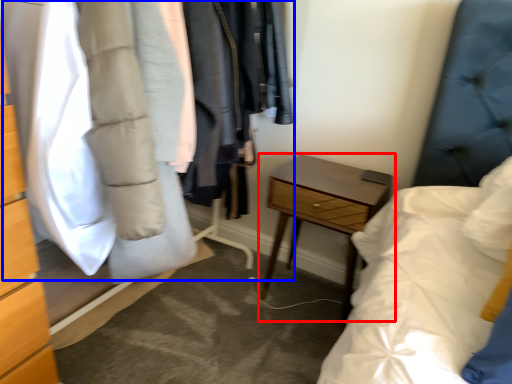
Question: Which point is further to the camera, nightstand (highlighted by a red box) or closet (highlighted by a blue box)?

Choices:
 (A) nightstand
 (B) closet

Answer: (A)